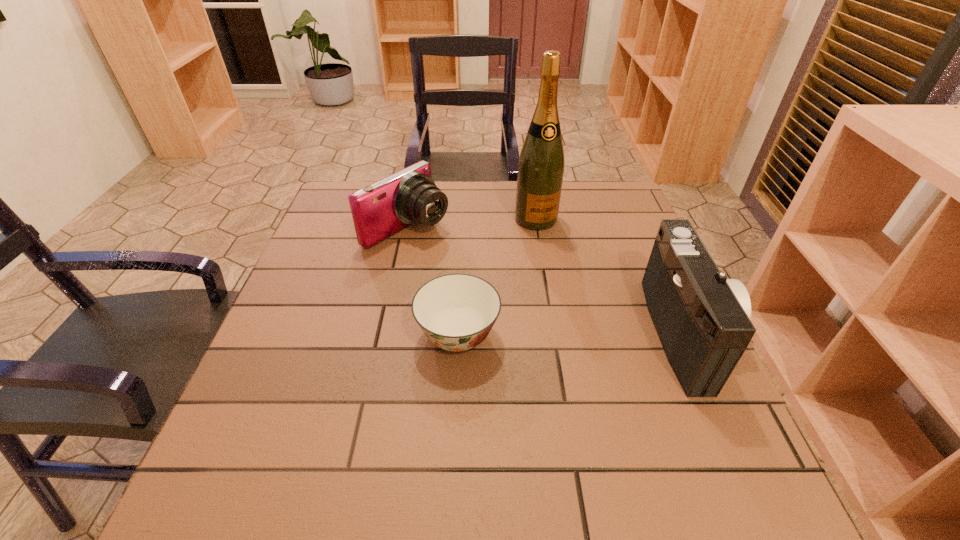
The height and width of the screenshot is (540, 960). What are the coordinates of `vacant region located on the front-facing side of the camera` in the screenshot? It's located at click(x=563, y=319).

Identify the location of vacant area located 0.120m on the front-facing side of the camera. Image resolution: width=960 pixels, height=540 pixels. (469, 264).

Find the location of a particular element. The image size is (960, 540). vacant space located 0.220m on the front-facing side of the camera is located at coordinates (500, 282).

Where is `wine bottle at the far edge`? wine bottle at the far edge is located at coordinates (541, 164).

Where is `camera that is at the far edge`? This screenshot has width=960, height=540. camera that is at the far edge is located at coordinates (379, 210).

This screenshot has height=540, width=960. I want to click on object that is at the left edge, so click(x=379, y=210).

The height and width of the screenshot is (540, 960). Identify the location of object located at the right edge. (702, 319).

The image size is (960, 540). What are the coordinates of `object that is at the far left corner` in the screenshot? It's located at (379, 210).

In the image, there is a desktop. Identify the location of free space at the far edge. The width and height of the screenshot is (960, 540). (455, 185).

At what (x,y) coordinates should I click in order to perform the action: click on vacant space at the near edge. Please return your answer as a coordinate pair (x, y). Looking at the image, I should click on (556, 442).